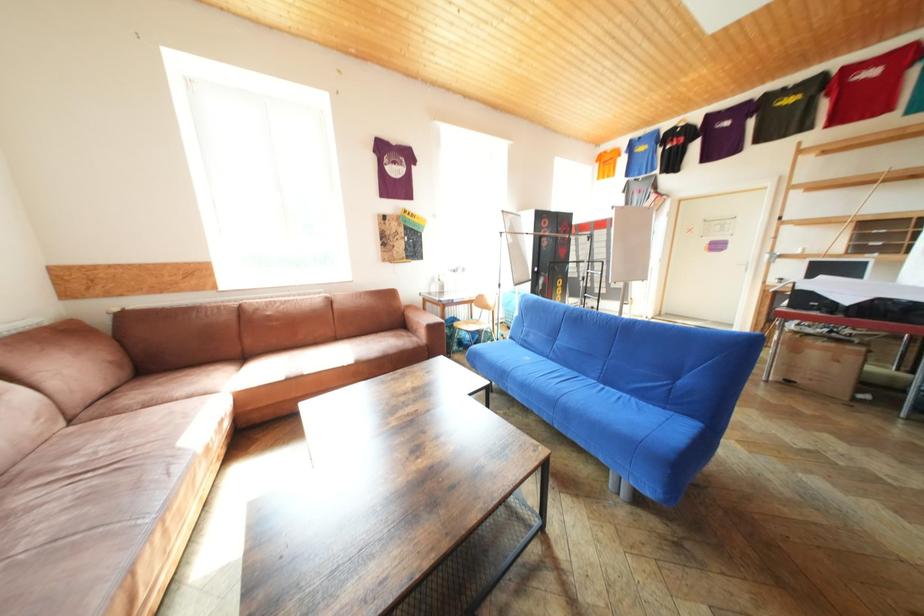
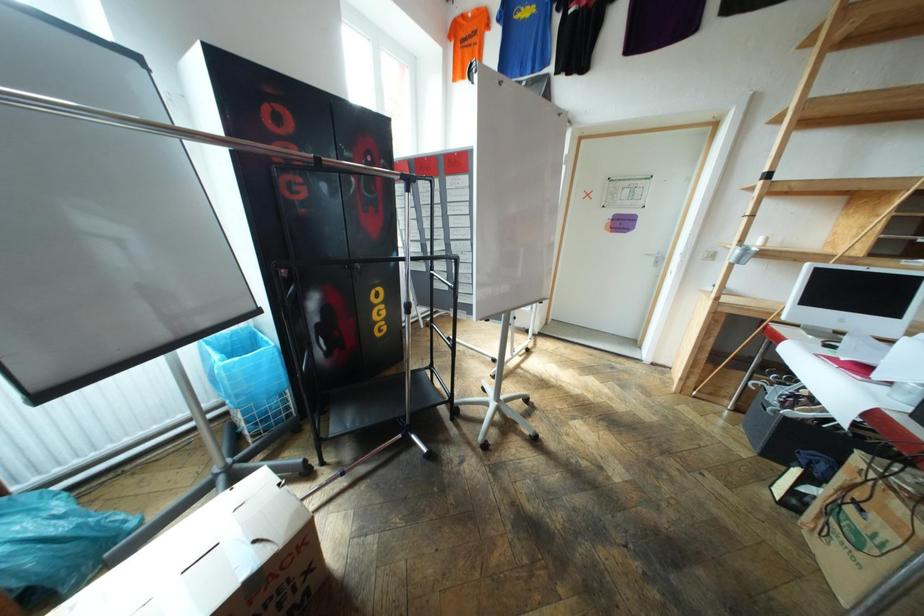
In a continuous first-person perspective shot, in which direction is the camera moving?

The cameraman moved toward right, forward.